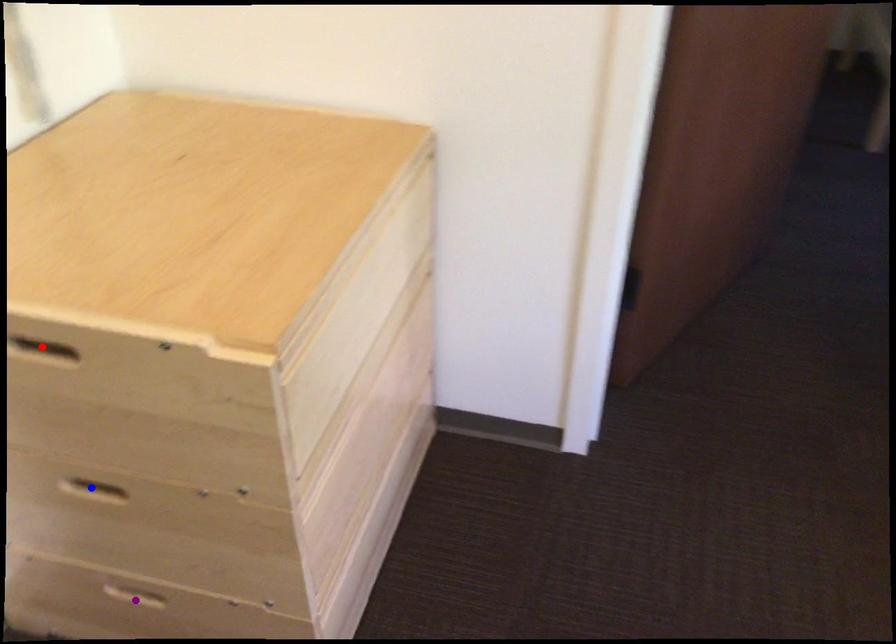
Order these from nearest to farthest:
purple point
red point
blue point

red point, blue point, purple point